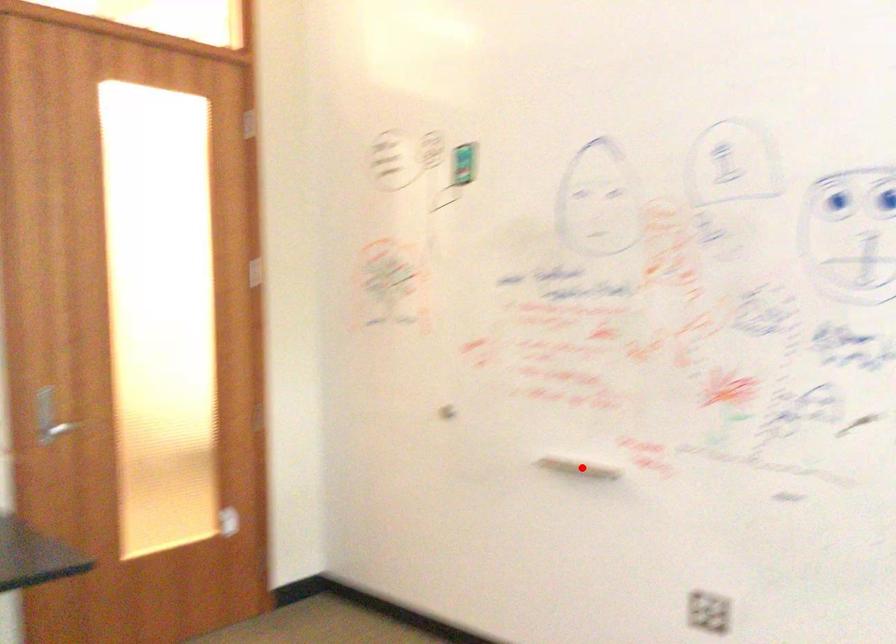
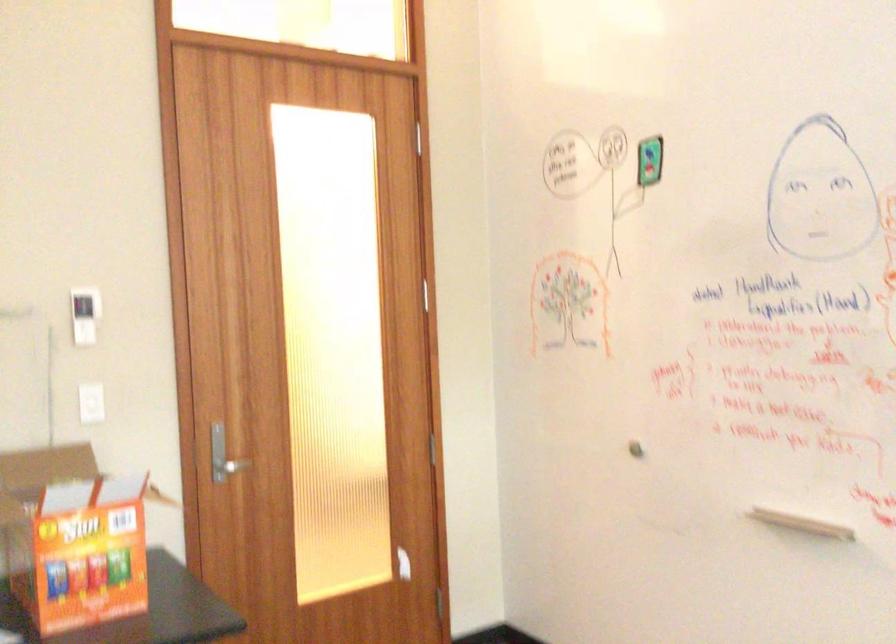
Question: I am providing you with two images of the same scene from different viewpoints. In image1, a red point is highlighted. Considering the same 3D point in image2, which of the following is correct?

Choices:
 (A) It is closer
 (B) It is farther

Answer: (A)